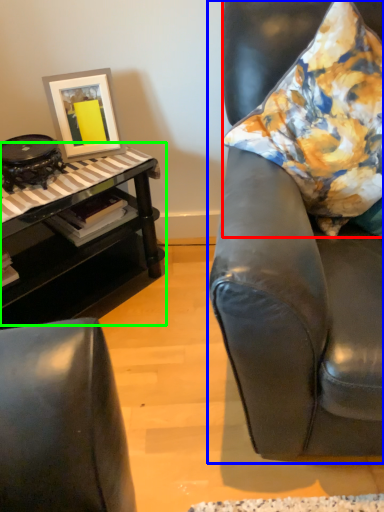
Question: Which object is positioned farthest from pillow (highlighted by a red box)? Select from chair (highlighted by a blue box) and table (highlighted by a green box).

Choices:
 (A) chair
 (B) table

Answer: (B)